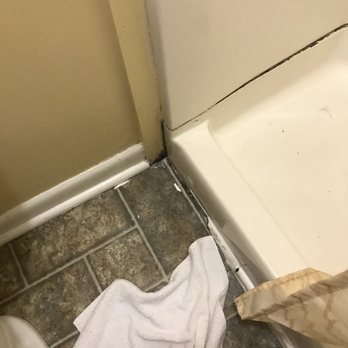
Find the location of a particular element. The height and width of the screenshot is (348, 348). light gray dividers between tile flooring is located at coordinates (81, 258), (137, 228), (19, 266), (61, 340), (227, 318), (151, 287).